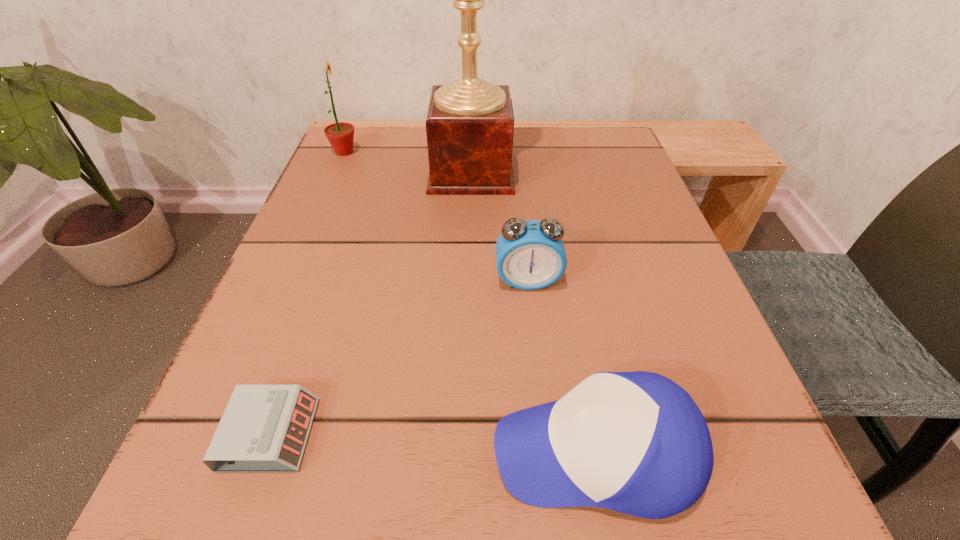
Choose which object is the nearest neighbor to the trophy cup. Please provide its 2D coordinates. Your answer should be formatted as a tuple, i.e. [(x, y)], where the tuple contains the x and y coordinates of a point satisfying the conditions above.

[(530, 255)]

This screenshot has width=960, height=540. Find the location of `free location that satisfies the following two spatial constraints: 1. on the face of the fourth shortest object; 2. on the left side of the left alarm clock`. free location that satisfies the following two spatial constraints: 1. on the face of the fourth shortest object; 2. on the left side of the left alarm clock is located at coordinates (224, 434).